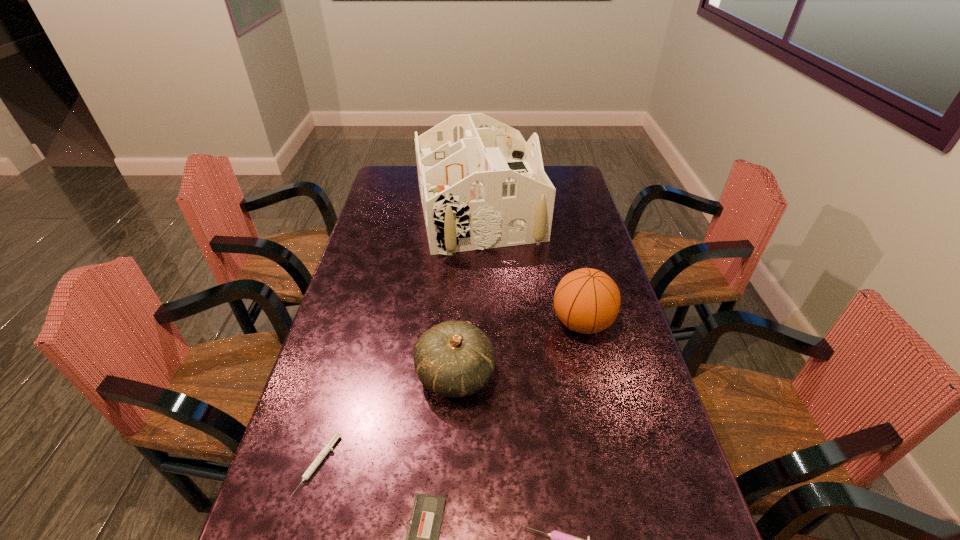
Identify the location of the tallest object. The height and width of the screenshot is (540, 960). (482, 186).

Locate an element on the screen. This screenshot has width=960, height=540. the farthest object is located at coordinates (482, 186).

Where is `basketball`? The image size is (960, 540). basketball is located at coordinates (586, 300).

The width and height of the screenshot is (960, 540). Identify the location of the third tallest object. (454, 359).

Find the location of `the second shortest object`. the second shortest object is located at coordinates (327, 448).

Locate an element on the screen. the left syringe is located at coordinates coord(327,448).

Locate an element on the screen. The width and height of the screenshot is (960, 540). vacant space located 0.100m on the back of the tallest object is located at coordinates (479, 167).

The image size is (960, 540). Identify the location of vacant space located 0.300m on the left of the basketball. pos(449,323).

The height and width of the screenshot is (540, 960). In order to click on free region located on the back of the fourth shortest object in this screenshot , I will do `click(461, 284)`.

Find the location of a particular element. The width and height of the screenshot is (960, 540). vacant space located on the back of the leftmost object is located at coordinates [x=352, y=343].